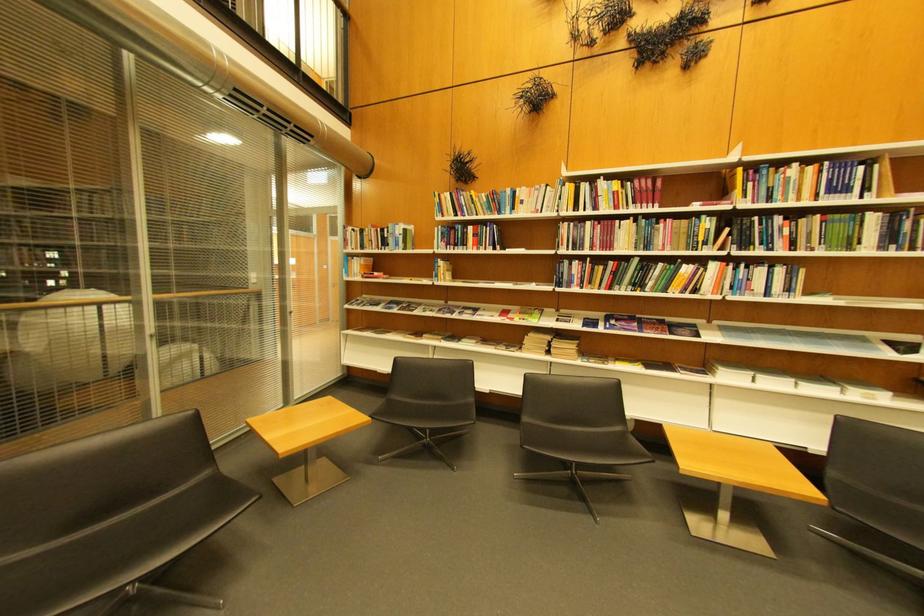
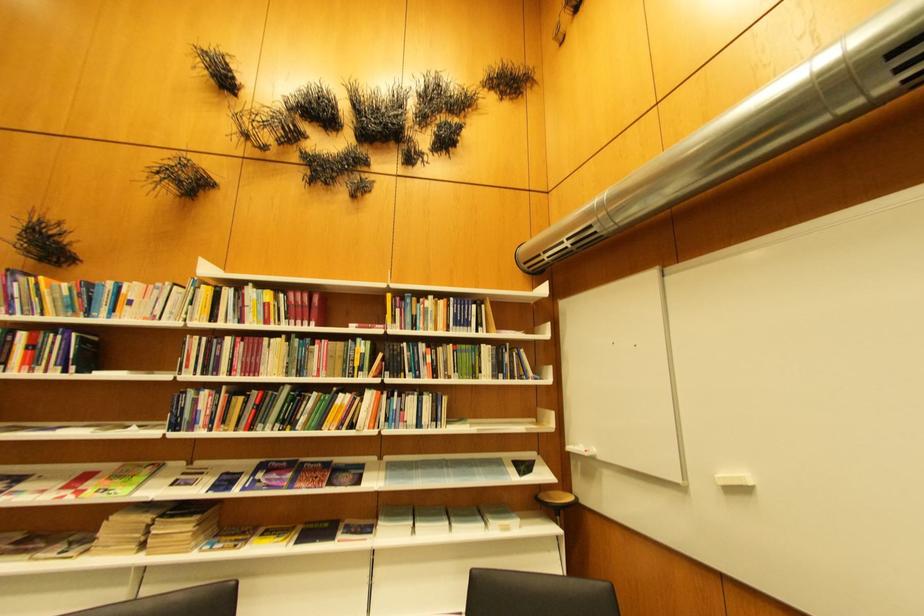
Locate, in the second image, the point that corresponds to pixel 696 371 in the first image.

(359, 531)